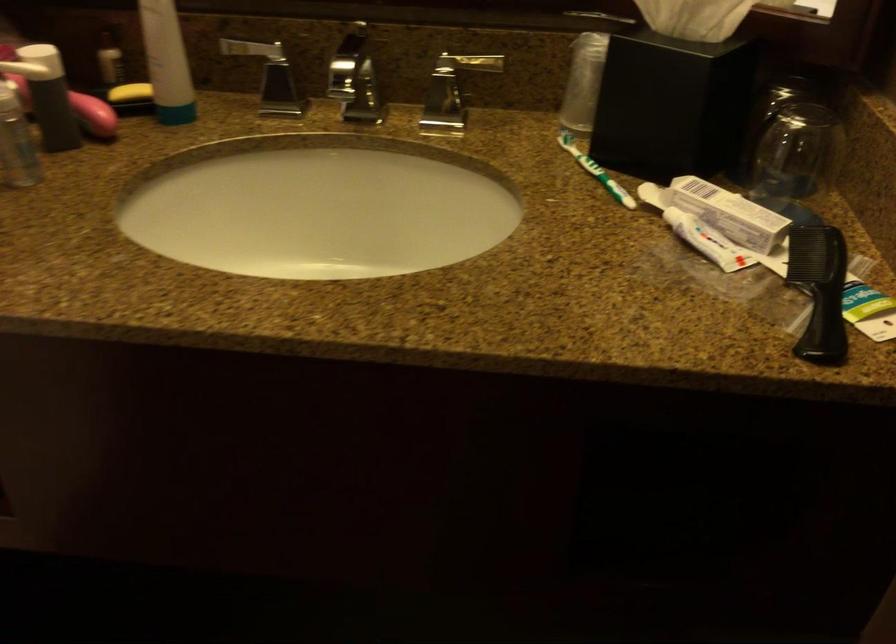
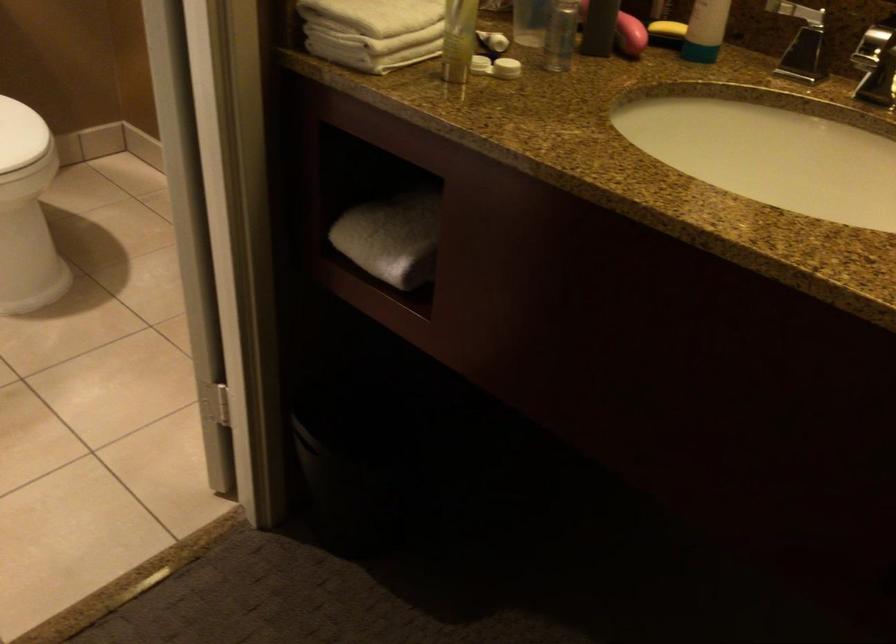
Question: How did the camera likely rotate?

Choices:
 (A) Left
 (B) Right
 (C) Up
 (D) Down

Answer: (A)